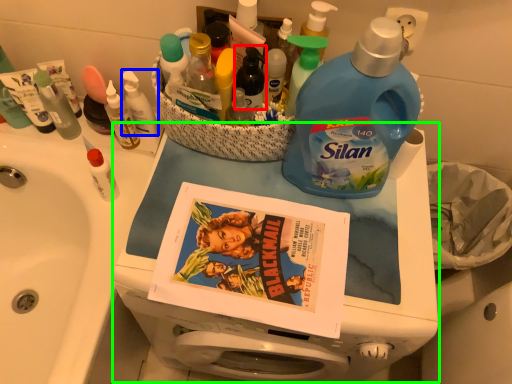
Question: Which object is positioned farthest from bottle (highlighted by a red box)? Select from toiletry (highlighted by a blue box) and appliance (highlighted by a green box).

Choices:
 (A) toiletry
 (B) appliance

Answer: (B)